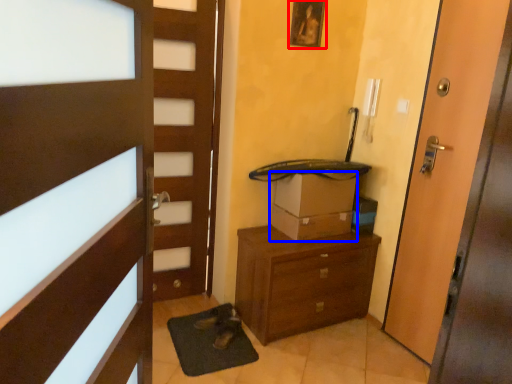
Question: Which object appears farthest to the camera in this image, picture frame (highlighted by a red box) or cardboard box (highlighted by a blue box)?

Choices:
 (A) picture frame
 (B) cardboard box

Answer: (B)